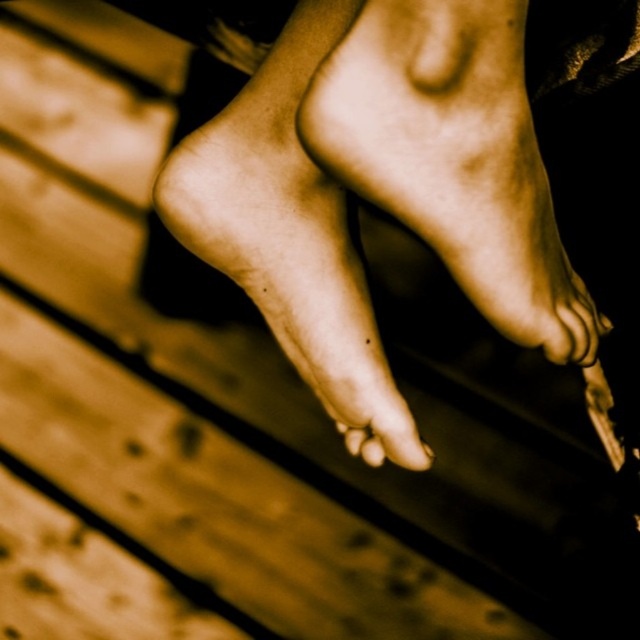
Question: Among these objects, which one is farthest from the camera?

Choices:
 (A) matte skin toe at center
 (B) smooth skin toe at center

Answer: (B)

Question: Which point appears closest to the camera in this image?

Choices:
 (A) (360, 454)
 (B) (380, 445)
 (C) (257, 220)

Answer: (C)

Question: Does smooth skin feet at center have a lesser width compared to matte skin toe at center?

Choices:
 (A) no
 (B) yes

Answer: (A)

Question: Can you confirm if smooth skin foot at center is wider than matte skin toe at center?

Choices:
 (A) yes
 (B) no

Answer: (A)

Question: Which object is the closest to the matte skin toe at center?

Choices:
 (A) smooth skin feet at center
 (B) smooth skin foot at center
 (C) smooth skin toe at center

Answer: (C)

Question: Does smooth skin foot at center appear over matte skin toe at center?

Choices:
 (A) no
 (B) yes

Answer: (B)